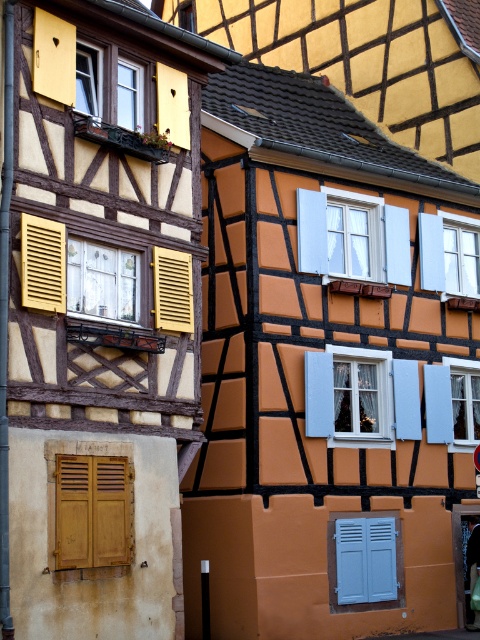
Question: Considering the relative positions of matte wood shutter at left and matte yellow shutter at center in the image provided, where is matte wood shutter at left located with respect to matte yellow shutter at center?

Choices:
 (A) left
 (B) right

Answer: (A)

Question: Among these objects, which one is farthest from the camera?

Choices:
 (A) matte yellow shutter at center
 (B) white matte shutter at center
 (C) wooden slats at lower left

Answer: (B)

Question: Which point is farther to the camera?

Choices:
 (A) blue matte shutter at lower center
 (B) wooden slats at lower left
 (C) matte wood shutter at left

Answer: (A)

Question: Which point is closer to the camera?

Choices:
 (A) blue matte shutter at lower center
 (B) matte wood shutter at left
 (C) matte yellow shutter at center

Answer: (B)

Question: Is matte wood shutter at left to the right of matte yellow shutter at center from the viewer's perspective?

Choices:
 (A) yes
 (B) no

Answer: (B)

Question: Observing the image, what is the correct spatial positioning of white matte shutter at center in reference to matte wood shutter at left?

Choices:
 (A) below
 (B) above

Answer: (B)